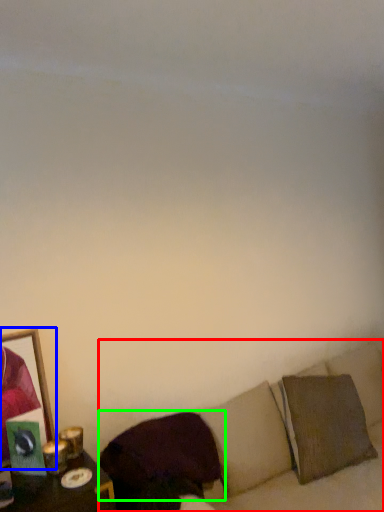
Question: Which object is positioned closest to couch (highlighted by a red box)? Select from picture frame (highlighted by a blue box) and pillow (highlighted by a green box).

Choices:
 (A) picture frame
 (B) pillow

Answer: (B)